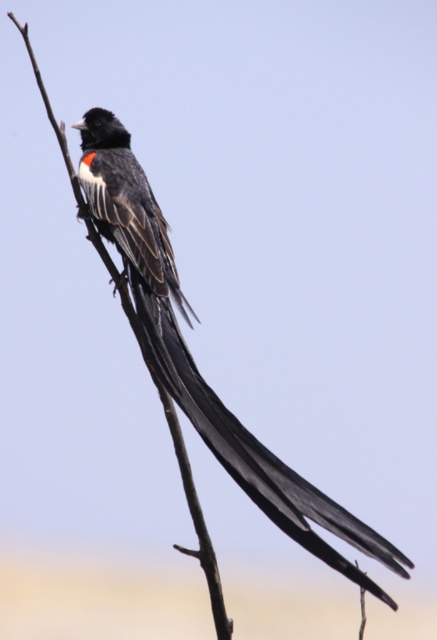
You are a birdwatcher observing the scene. The bird has a black feathered tail at center and is perched on a brown wood tree branch at center. Can you determine which object is positioned higher in the image?

The black feathered tail at center is above the brown wood tree branch at center, so the black feathered tail at center is positioned higher in the image.

You are a wildlife photographer trying to capture the bird in the image. You need to ensure the black feathered tail at center and the brown wood tree branch at center are both visible in your shot. Given their sizes, which object will occupy more space in the photo?

The black feathered tail at center has a larger size compared to the brown wood tree branch at center, so it will occupy more space in the photo.

In the scene shown: You are standing at a certain distance from a bird perched on a thin, bare branch against a gradient sky. The bird has black plumage with a white chest bordered by red and long, slender tail feathers. You notice a specific point labeled as point [228,452]. Can you determine if this point is closer to you than 5 meters?

The distance between point [228,452] and the viewer is 4.24 meters, which is less than 5 meters. Therefore, the point is closer than 5 meters.